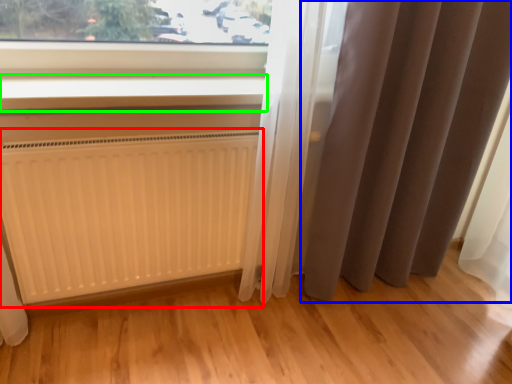
Question: Which object is positioned farthest from radiator (highlighted by a red box)? Select from curtain (highlighted by a blue box) and window sill (highlighted by a green box).

Choices:
 (A) curtain
 (B) window sill

Answer: (A)